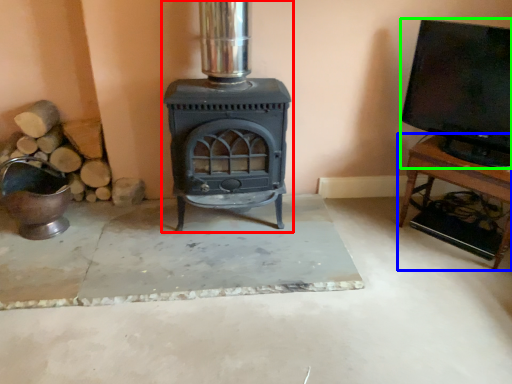
Question: Which is nearer to the wood burning stove (highlighted by a red box)? furniture (highlighted by a blue box) or wide (highlighted by a green box).

Choices:
 (A) furniture
 (B) wide

Answer: (B)